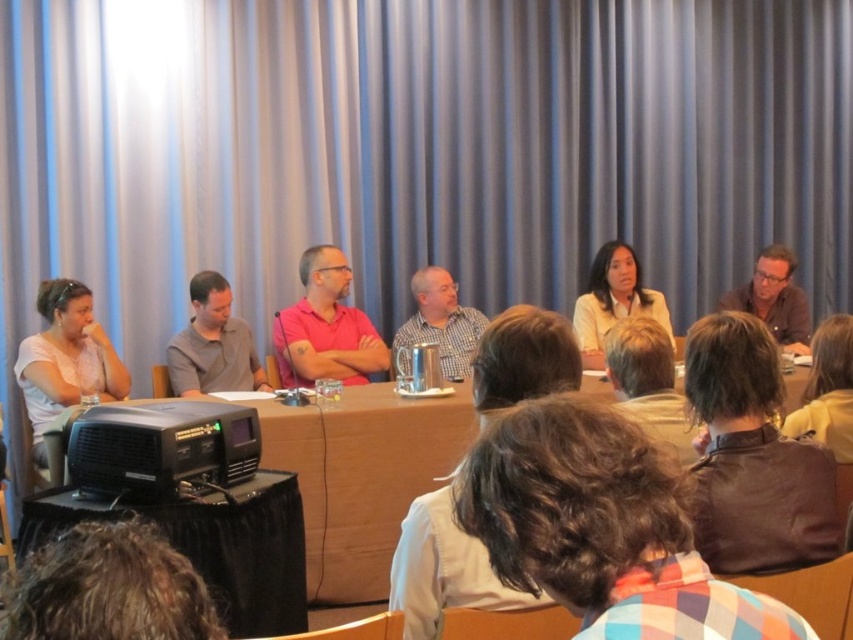
Is pink matte shirt at center below white shirt at center?

No.

Between pink matte shirt at center and white shirt at center, which one appears on the right side from the viewer's perspective?

white shirt at center

Measure the distance between pink matte shirt at center and camera.

pink matte shirt at center and camera are 13.42 feet apart.

Locate an element on the screen. The width and height of the screenshot is (853, 640). pink matte shirt at center is located at coordinates (325, 326).

Is brown wood table at center taller than white matte shirt at left?

Yes, brown wood table at center is taller than white matte shirt at left.

Between brown wood table at center and white matte shirt at left, which one is positioned lower?

brown wood table at center

Find the location of `brown wood table at center`. brown wood table at center is located at coordinates (361, 477).

Which is more to the left, checkered shirt at center or gray casual shirt at center?

Positioned to the left is gray casual shirt at center.

Locate an element on the screen. This screenshot has height=640, width=853. checkered shirt at center is located at coordinates (444, 570).

The image size is (853, 640). Identify the location of checkered shirt at center. (444, 570).